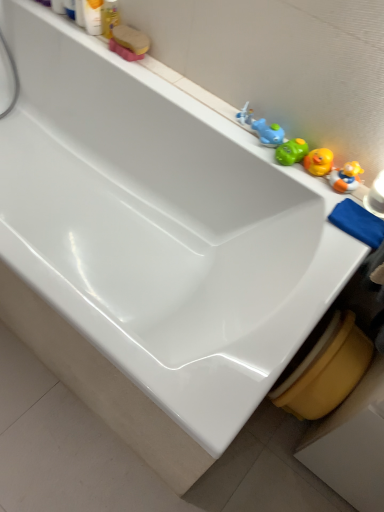
Question: Could you tell me if blue rubber duck at upper right, placed as the 2th toy when sorted from bottom to top, is facing white plastic toy at upper right, arranged as the 3th toy when viewed from the right?

Choices:
 (A) no
 (B) yes

Answer: (A)

Question: Is blue rubber duck at upper right, which ranks as the third toy in left-to-right order, next to white plastic toy at upper right, marked as the 2th toy in a top-to-bottom arrangement?

Choices:
 (A) no
 (B) yes

Answer: (B)

Question: From a real-world perspective, does blue rubber duck at upper right, the second toy from the right, stand above white plastic toy at upper right, the third toy when ordered from bottom to top?

Choices:
 (A) no
 (B) yes

Answer: (B)

Question: Is blue rubber duck at upper right, which ranks as the third toy in left-to-right order, surrounding white plastic toy at upper right, marked as the 2th toy in a top-to-bottom arrangement?

Choices:
 (A) no
 (B) yes

Answer: (A)

Question: Does blue rubber duck at upper right, which ranks as the third toy in left-to-right order, appear on the left side of white plastic toy at upper right, arranged as the 3th toy when viewed from the right?

Choices:
 (A) no
 (B) yes

Answer: (A)

Question: Is white plastic toy at upper right, the third toy when ordered from bottom to top, in front of or behind blue cloth at right in the image?

Choices:
 (A) behind
 (B) front

Answer: (A)

Question: From a real-world perspective, relative to blue cloth at right, is white plastic toy at upper right, arranged as the 3th toy when viewed from the right, vertically above or below?

Choices:
 (A) above
 (B) below

Answer: (A)

Question: Is white plastic toy at upper right, the second toy in the left-to-right sequence, wider or thinner than blue cloth at right?

Choices:
 (A) wide
 (B) thin

Answer: (B)

Question: From the image's perspective, is white plastic toy at upper right, arranged as the 3th toy when viewed from the right, positioned above or below blue cloth at right?

Choices:
 (A) above
 (B) below

Answer: (A)

Question: Is matte plastic soap at upper left, which is counted as the 1th toiletry, starting from the right, bigger or smaller than white plastic toy at upper right, the third toy when ordered from bottom to top?

Choices:
 (A) big
 (B) small

Answer: (A)

Question: In terms of height, does matte plastic soap at upper left, which is counted as the 1th toiletry, starting from the right, look taller or shorter compared to white plastic toy at upper right, the second toy in the left-to-right sequence?

Choices:
 (A) tall
 (B) short

Answer: (A)

Question: Relative to white plastic toy at upper right, the third toy when ordered from bottom to top, is matte plastic soap at upper left, which is counted as the 1th toiletry, starting from the right, in front or behind?

Choices:
 (A) front
 (B) behind

Answer: (B)

Question: From a real-world perspective, is matte plastic soap at upper left, the second toiletry from the left, physically located above or below white plastic toy at upper right, marked as the 2th toy in a top-to-bottom arrangement?

Choices:
 (A) above
 (B) below

Answer: (A)

Question: Considering the positions of white plastic toy at upper right, arranged as the 3th toy when viewed from the right, and blue rubber duck at upper right, which appears as the 3th toy when viewed from the top, in the image, is white plastic toy at upper right, arranged as the 3th toy when viewed from the right, taller or shorter than blue rubber duck at upper right, which appears as the 3th toy when viewed from the top,?

Choices:
 (A) tall
 (B) short

Answer: (B)

Question: Does point (240, 115) appear closer or farther from the camera than point (244, 108)?

Choices:
 (A) farther
 (B) closer

Answer: (A)